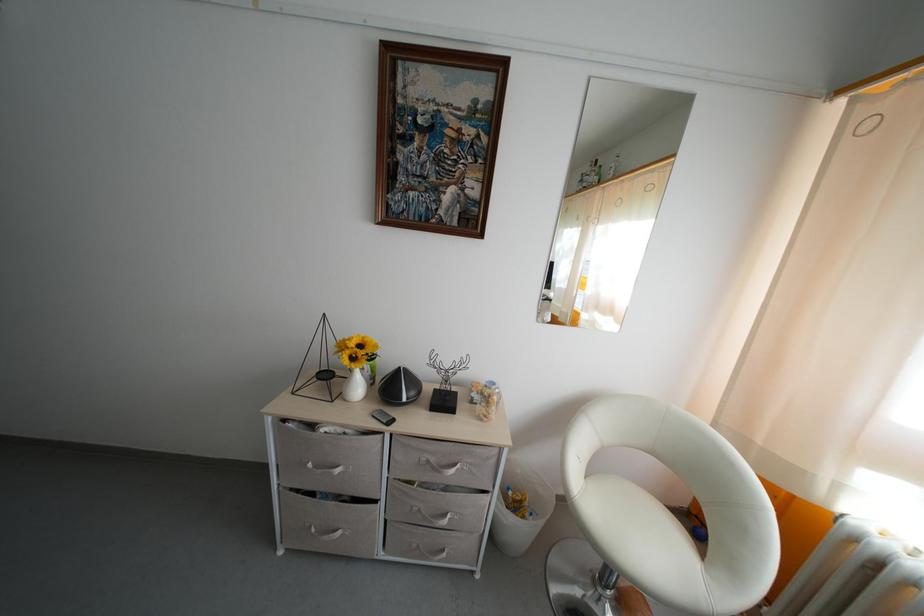
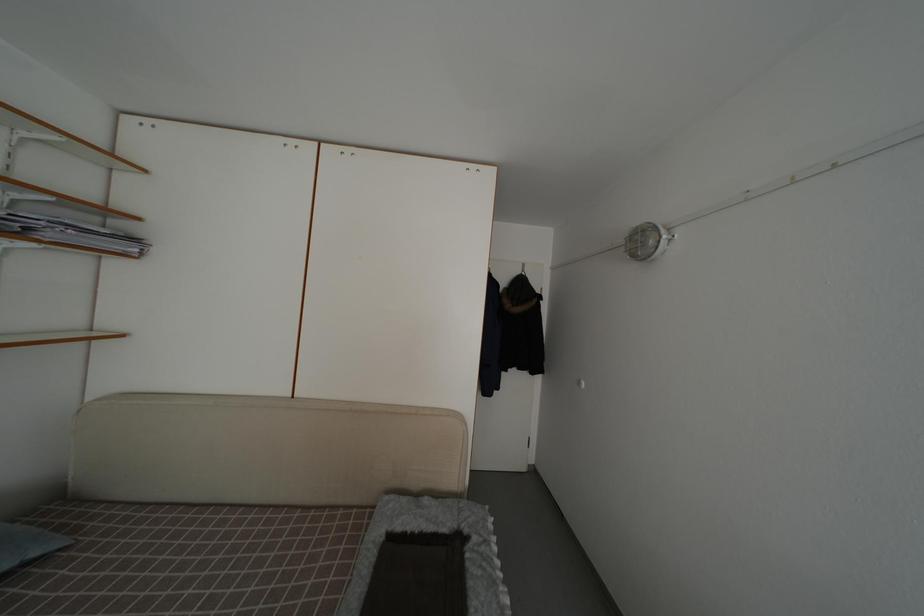
Question: The camera is either moving clockwise (left) or counter-clockwise (right) around the object. The first image is from the beginning of the video and the second image is from the end. Is the camera moving left or right when shooting the video?

Choices:
 (A) Left
 (B) Right

Answer: (B)